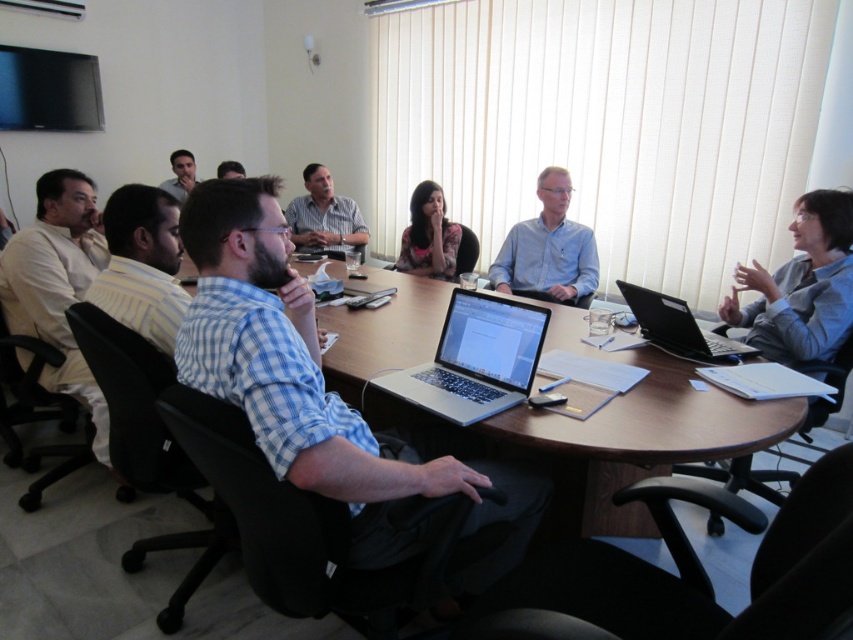
Question: Which object is farther from the camera taking this photo?

Choices:
 (A) black matte laptop at right
 (B) silver metallic round table at center
 (C) white cotton shirt at left
 (D) light blue shirt at center

Answer: (D)

Question: Which point appears farthest from the camera in this image?

Choices:
 (A) (688, 328)
 (B) (62, 385)

Answer: (B)

Question: Is striped shirt at center to the left of floral shirt at center from the viewer's perspective?

Choices:
 (A) no
 (B) yes

Answer: (B)

Question: Is light brown textured shirt at center positioned in front of floral shirt at center?

Choices:
 (A) yes
 (B) no

Answer: (B)

Question: Is blue plaid shirt at center positioned before black matte laptop at right?

Choices:
 (A) yes
 (B) no

Answer: (A)

Question: Estimate the real-world distances between objects in this image. Which object is closer to the light blue shirt at center?

Choices:
 (A) floral shirt at center
 (B) white cotton shirt at left
 (C) bearded man at center
 (D) black fabric chair at lower center

Answer: (A)